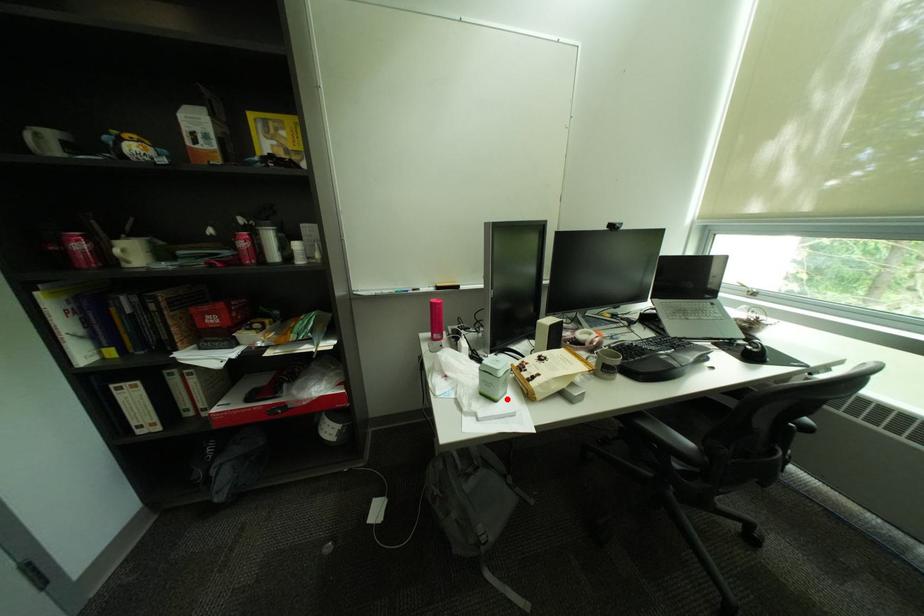
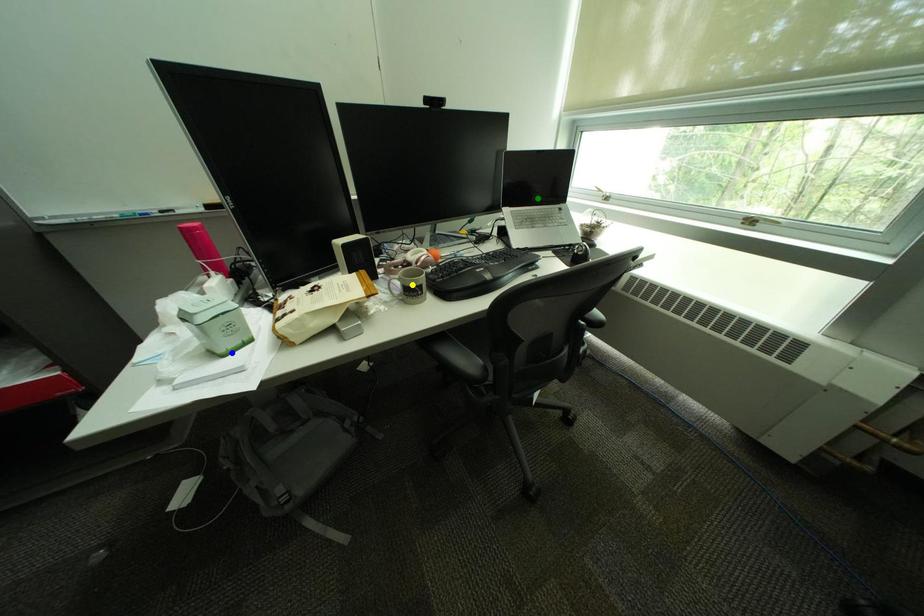
Question: I am providing you with two images of the same scene from different viewpoints. A red point is marked on the first image. You are given multiple points on the second image. Which mark in image 2 goes with the point in image 1?

Choices:
 (A) blue point
 (B) yellow point
 (C) green point

Answer: (A)